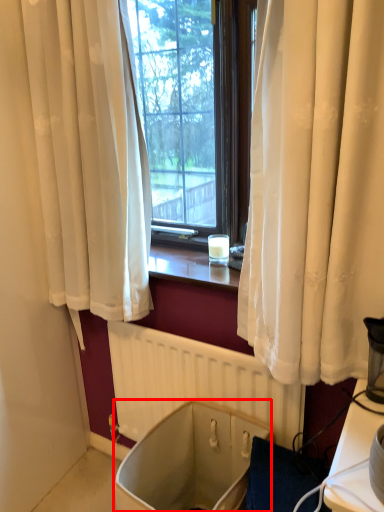
Question: From the image's perspective, what is the correct spatial positioning of bath (annotated by the red box) in reference to radiator?

Choices:
 (A) above
 (B) below

Answer: (B)